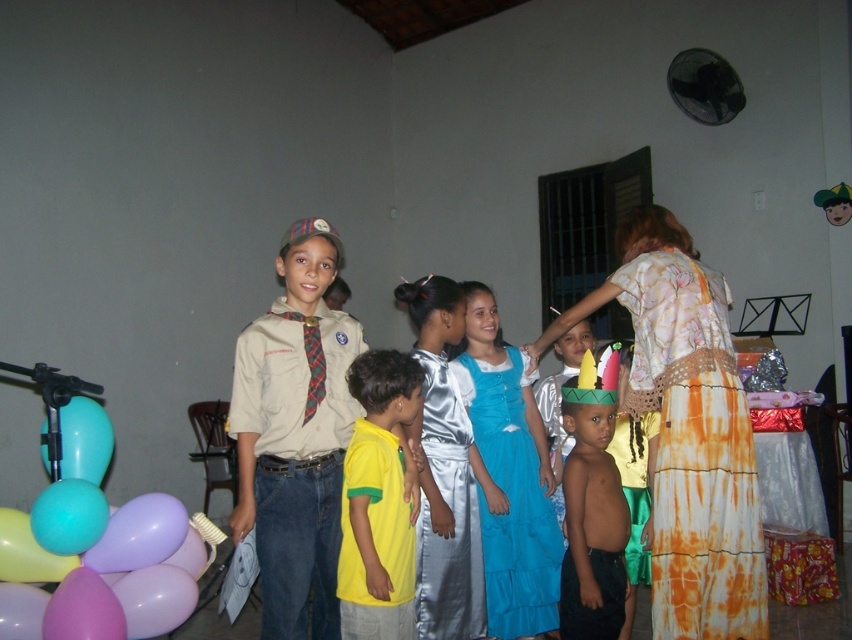
Question: Can you confirm if blue satin dress at center is positioned below shiny gold crown at center?

Choices:
 (A) yes
 (B) no

Answer: (A)

Question: Which object is farther from the camera taking this photo?

Choices:
 (A) khaki cotton shirt at center
 (B) shiny gold crown at center
 (C) yellow-green t-shirt at center
 (D) translucent blue balloon at lower left

Answer: (D)

Question: Is yellow-green t-shirt at center wider than shiny gold crown at center?

Choices:
 (A) yes
 (B) no

Answer: (A)

Question: Considering the real-world distances, which object is farthest from the khaki cotton shirt at center?

Choices:
 (A) translucent blue balloon at lower left
 (B) blue satin dress at center
 (C) pastel balloons at lower left

Answer: (A)

Question: Is satin silver dress at center wider than translucent blue balloon at lower left?

Choices:
 (A) no
 (B) yes

Answer: (A)

Question: Estimate the real-world distances between objects in this image. Which object is closer to the pastel balloons at lower left?

Choices:
 (A) yellow-green t-shirt at center
 (B) satin silver dress at center
 (C) khaki cotton shirt at center
 (D) translucent blue balloon at lower left

Answer: (D)